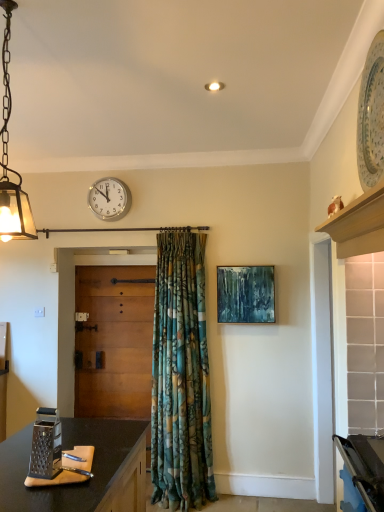
This screenshot has width=384, height=512. What are the coordinates of `empty space that is ontop of metallic grater at lower left (from a real-world perspective)` in the screenshot? It's located at (63, 458).